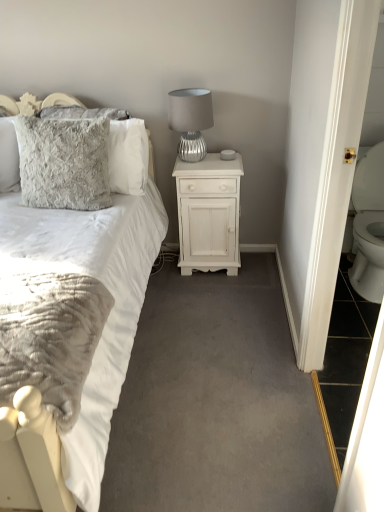
This screenshot has width=384, height=512. In order to click on white painted wood nightstand at center in this screenshot , I will do `click(209, 214)`.

What is the approximate height of white soft fabric bed at left?

The height of white soft fabric bed at left is 1.16 meters.

Describe the element at coordinates (70, 332) in the screenshot. I see `white soft fabric bed at left` at that location.

Image resolution: width=384 pixels, height=512 pixels. Find the location of `silver textured lamp at upper right`. silver textured lamp at upper right is located at coordinates (190, 121).

The image size is (384, 512). I want to click on fluffy gray pillow at upper left, which is counted as the 2th pillow, starting from the front, so click(117, 145).

Between point (188, 96) and point (97, 258), which one is positioned in front?

The point (97, 258) is closer to the camera.

Is silver textured lamp at upper right bigger or smaller than white soft fabric bed at left?

Considering their sizes, silver textured lamp at upper right takes up less space than white soft fabric bed at left.

Could you tell me if silver textured lamp at upper right is facing white soft fabric bed at left?

No.

Considering the relative positions of silver textured lamp at upper right and white soft fabric bed at left in the image provided, is silver textured lamp at upper right to the left or to the right of white soft fabric bed at left?

Clearly, silver textured lamp at upper right is on the right of white soft fabric bed at left in the image.

Based on the photo, in terms of height, does white painted wood nightstand at center look taller or shorter compared to fluffy gray pillow at upper left, positioned as the 1th pillow in back-to-front order?

Considering their sizes, white painted wood nightstand at center has more height than fluffy gray pillow at upper left, positioned as the 1th pillow in back-to-front order.

The image size is (384, 512). Identify the location of nightstand on the right of fluffy gray pillow at upper left, which is counted as the 2th pillow, starting from the front. 209,214.

Are white painted wood nightstand at center and fluffy gray pillow at upper left, positioned as the 1th pillow in back-to-front order, beside each other?

white painted wood nightstand at center and fluffy gray pillow at upper left, positioned as the 1th pillow in back-to-front order, are clearly separated.

From a real-world perspective, is white soft fabric bed at left located beneath fuzzy gray pillow at upper left, which ranks as the first pillow in front-to-back order?

Correct, in the physical world, white soft fabric bed at left is lower than fuzzy gray pillow at upper left, which ranks as the first pillow in front-to-back order.

Considering the points (73, 467) and (33, 133), which point is in front, point (73, 467) or point (33, 133)?

The point (73, 467) is in front.

Would you say white soft fabric bed at left is to the left or to the right of fuzzy gray pillow at upper left, which ranks as the first pillow in front-to-back order, in the picture?

In the image, white soft fabric bed at left appears on the left side of fuzzy gray pillow at upper left, which ranks as the first pillow in front-to-back order.

How distant is white soft fabric bed at left from fuzzy gray pillow at upper left, which is the 2th pillow from back to front?

white soft fabric bed at left and fuzzy gray pillow at upper left, which is the 2th pillow from back to front, are 15.08 inches apart from each other.

Find the location of `nightstand below the silver textured lamp at upper right (from the image's perspective)`. nightstand below the silver textured lamp at upper right (from the image's perspective) is located at coordinates (209, 214).

Would you say silver textured lamp at upper right is a long distance from white painted wood nightstand at center?

No, silver textured lamp at upper right is in close proximity to white painted wood nightstand at center.

From a real-world perspective, is silver textured lamp at upper right positioned under white painted wood nightstand at center based on gravity?

Incorrect, from a real-world perspective, silver textured lamp at upper right is higher than white painted wood nightstand at center.

Would you say silver textured lamp at upper right is outside white painted wood nightstand at center?

Yes, silver textured lamp at upper right is not within white painted wood nightstand at center.

Considering the sizes of fuzzy gray pillow at upper left, which is the 2th pillow from back to front, and white painted wood nightstand at center in the image, is fuzzy gray pillow at upper left, which is the 2th pillow from back to front, wider or thinner than white painted wood nightstand at center?

fuzzy gray pillow at upper left, which is the 2th pillow from back to front, is thinner than white painted wood nightstand at center.

Does point (56, 159) appear closer or farther from the camera than point (180, 179)?

Point (56, 159) is closer to the camera than point (180, 179).

Are fuzzy gray pillow at upper left, which is the 2th pillow from back to front, and white painted wood nightstand at center far apart?

fuzzy gray pillow at upper left, which is the 2th pillow from back to front, is actually quite close to white painted wood nightstand at center.

Considering the relative sizes of fuzzy gray pillow at upper left, which is the 2th pillow from back to front, and white painted wood nightstand at center in the image provided, is fuzzy gray pillow at upper left, which is the 2th pillow from back to front, shorter than white painted wood nightstand at center?

Correct, fuzzy gray pillow at upper left, which is the 2th pillow from back to front, is not as tall as white painted wood nightstand at center.

Locate an element on the screen. The image size is (384, 512). nightstand located underneath the white soft fabric bed at left (from a real-world perspective) is located at coordinates (209, 214).

Does white painted wood nightstand at center have a larger size compared to white soft fabric bed at left?

Actually, white painted wood nightstand at center might be smaller than white soft fabric bed at left.

Is the position of white painted wood nightstand at center less distant than that of white soft fabric bed at left?

No, it is not.

Considering the positions of objects white painted wood nightstand at center and white soft fabric bed at left in the image provided, who is more to the right, white painted wood nightstand at center or white soft fabric bed at left?

From the viewer's perspective, white painted wood nightstand at center appears more on the right side.

In terms of width, does white soft fabric bed at left look wider or thinner when compared to white painted wood nightstand at center?

In the image, white soft fabric bed at left appears to be wider than white painted wood nightstand at center.

Is white painted wood nightstand at center completely or partially inside white soft fabric bed at left?

No, white painted wood nightstand at center is not surrounded by white soft fabric bed at left.

Which point is more distant from viewer, (130, 332) or (191, 221)?

Positioned behind is point (191, 221).

Is the position of white soft fabric bed at left less distant than that of white painted wood nightstand at center?

That is True.

This screenshot has width=384, height=512. There is a white soft fabric bed at left. Find the location of `table lamp above it (from a real-world perspective)`. table lamp above it (from a real-world perspective) is located at coordinates (190, 121).

At what (x,y) coordinates should I click in order to perform the action: click on nightstand on the right of fluffy gray pillow at upper left, positioned as the 1th pillow in back-to-front order. Please return your answer as a coordinate pair (x, y). Image resolution: width=384 pixels, height=512 pixels. Looking at the image, I should click on (209, 214).

Which object lies further to the anchor point fuzzy gray pillow at upper left, which is the 2th pillow from back to front, white painted wood nightstand at center or silver textured lamp at upper right?

white painted wood nightstand at center.

Which object lies nearer to the anchor point silver textured lamp at upper right, white painted wood nightstand at center or white soft fabric bed at left?

The object closer to silver textured lamp at upper right is white painted wood nightstand at center.

When comparing their distances from white painted wood nightstand at center, does fluffy gray pillow at upper left, which is counted as the 2th pillow, starting from the front, or silver textured lamp at upper right seem further?

fluffy gray pillow at upper left, which is counted as the 2th pillow, starting from the front, is positioned further to the anchor white painted wood nightstand at center.

Based on the photo, estimate the real-world distances between objects in this image. Which object is closer to white painted wood nightstand at center, silver textured lamp at upper right or fluffy gray pillow at upper left, positioned as the 1th pillow in back-to-front order?

Among the two, silver textured lamp at upper right is located nearer to white painted wood nightstand at center.

Considering their positions, is silver textured lamp at upper right positioned closer to white soft fabric bed at left than fluffy gray pillow at upper left, which is counted as the 2th pillow, starting from the front?

fluffy gray pillow at upper left, which is counted as the 2th pillow, starting from the front, is positioned closer to the anchor white soft fabric bed at left.

Considering their positions, is silver textured lamp at upper right positioned closer to white painted wood nightstand at center than white soft fabric bed at left?

Based on the image, silver textured lamp at upper right appears to be nearer to white painted wood nightstand at center.

Based on their spatial positions, is white soft fabric bed at left or fuzzy gray pillow at upper left, which ranks as the first pillow in front-to-back order, further from fluffy gray pillow at upper left, which is counted as the 2th pillow, starting from the front?

Among the two, white soft fabric bed at left is located further to fluffy gray pillow at upper left, which is counted as the 2th pillow, starting from the front.

Looking at the image, which one is located closer to silver textured lamp at upper right, fluffy gray pillow at upper left, which is counted as the 2th pillow, starting from the front, or white painted wood nightstand at center?

Based on the image, white painted wood nightstand at center appears to be nearer to silver textured lamp at upper right.

Where is `pillow between fuzzy gray pillow at upper left, which ranks as the first pillow in front-to-back order, and white painted wood nightstand at center, in the horizontal direction`? The height and width of the screenshot is (512, 384). pillow between fuzzy gray pillow at upper left, which ranks as the first pillow in front-to-back order, and white painted wood nightstand at center, in the horizontal direction is located at coordinates (117, 145).

Find the location of a particular element. table lamp between fuzzy gray pillow at upper left, which is the 2th pillow from back to front, and white painted wood nightstand at center from left to right is located at coordinates (190, 121).

Identify the location of pillow between white soft fabric bed at left and fluffy gray pillow at upper left, positioned as the 1th pillow in back-to-front order, along the z-axis. (64, 162).

Find the location of `table lamp between fluffy gray pillow at upper left, which is counted as the 2th pillow, starting from the front, and white painted wood nightstand at center`. table lamp between fluffy gray pillow at upper left, which is counted as the 2th pillow, starting from the front, and white painted wood nightstand at center is located at coordinates (190, 121).